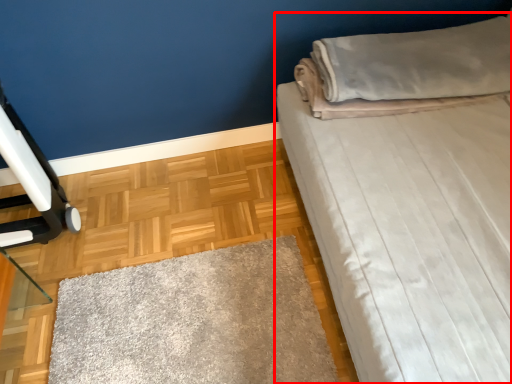
Question: In this image, where is bed (annotated by the red box) located relative to pillow?

Choices:
 (A) left
 (B) right

Answer: (B)